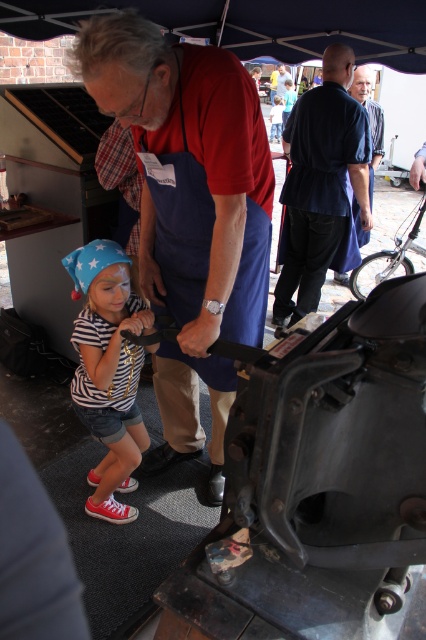
Question: Does blue apron at center appear on the left side of striped cotton shirt at lower left?

Choices:
 (A) no
 (B) yes

Answer: (A)

Question: Among these points, which one is farthest from the camera?

Choices:
 (A) (104, 284)
 (B) (336, 184)
 (C) (178, 321)

Answer: (B)

Question: Does blue apron at center have a larger size compared to dark blue shirt at upper center?

Choices:
 (A) no
 (B) yes

Answer: (A)

Question: Is striped cotton shirt at lower left above dark blue shirt at upper center?

Choices:
 (A) yes
 (B) no

Answer: (B)

Question: Which point is farther to the camera?

Choices:
 (A) (184, 202)
 (B) (350, 116)
 (C) (373, 170)

Answer: (C)

Question: Which point is closer to the camera?

Choices:
 (A) dark blue fabric shirt at center
 (B) striped cotton shirt at lower left
 (C) blue apron at center

Answer: (C)